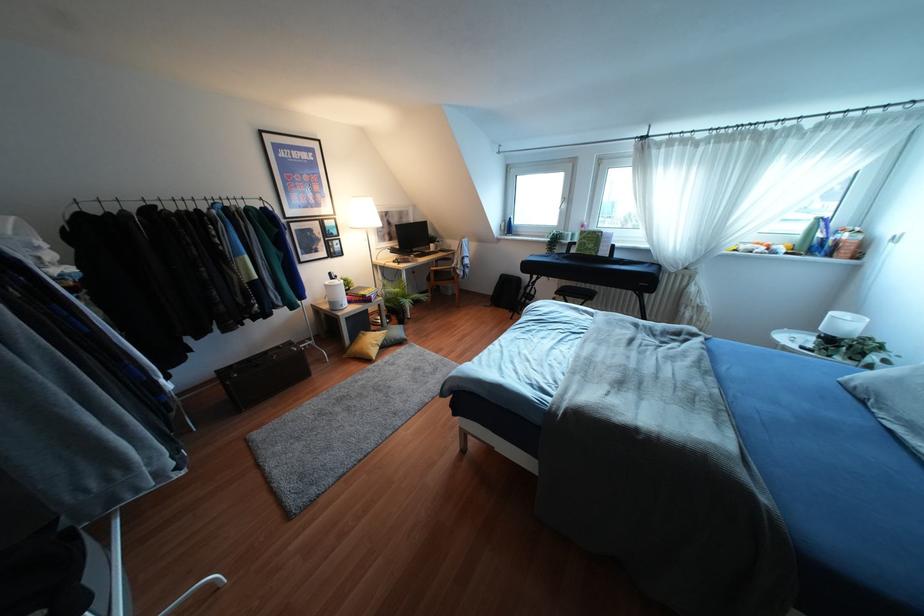
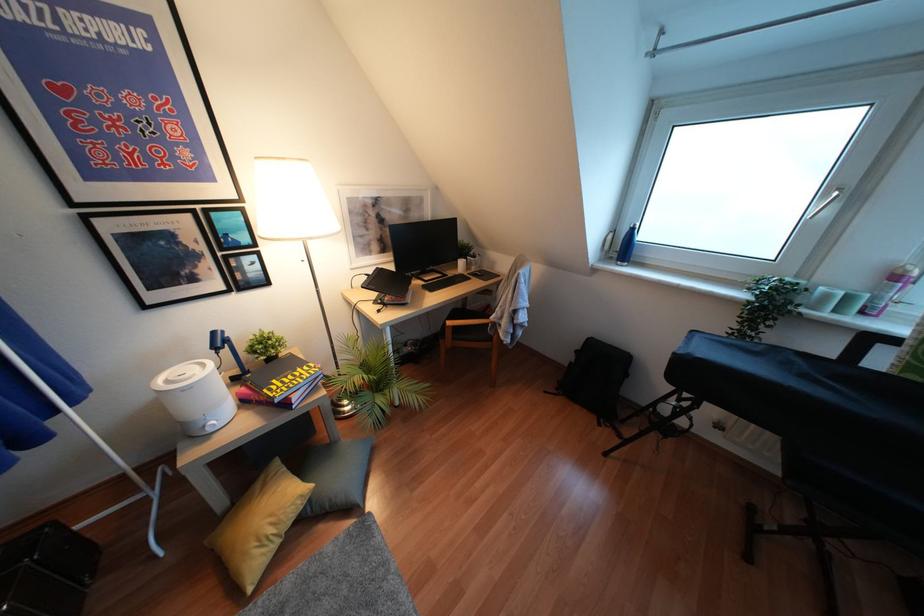
Locate, in the second image, the point that corresponds to point (507, 227) in the first image.

(623, 246)